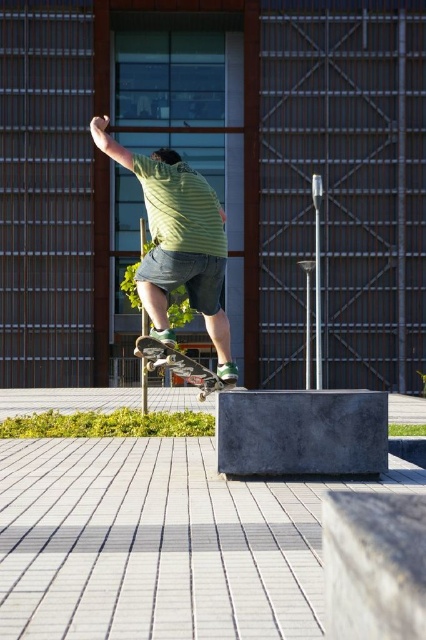
Is green striped shirt at upper center to the right of wooden skateboard at center from the viewer's perspective?

Correct, you'll find green striped shirt at upper center to the right of wooden skateboard at center.

Is point (167, 189) closer to viewer compared to point (178, 374)?

Yes.

This screenshot has height=640, width=426. Describe the element at coordinates (178, 241) in the screenshot. I see `green striped shirt at upper center` at that location.

Image resolution: width=426 pixels, height=640 pixels. Find the location of `green striped shirt at upper center`. green striped shirt at upper center is located at coordinates (178, 241).